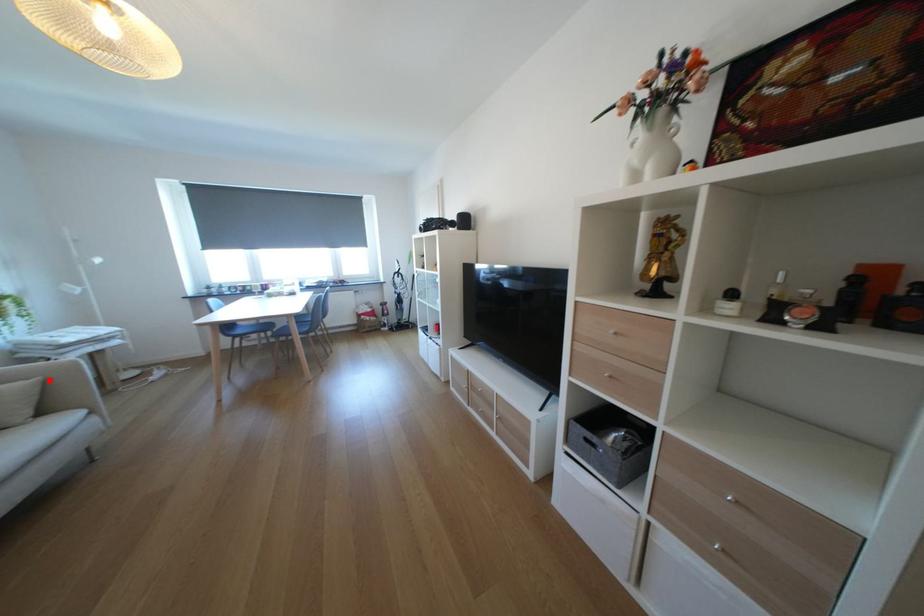
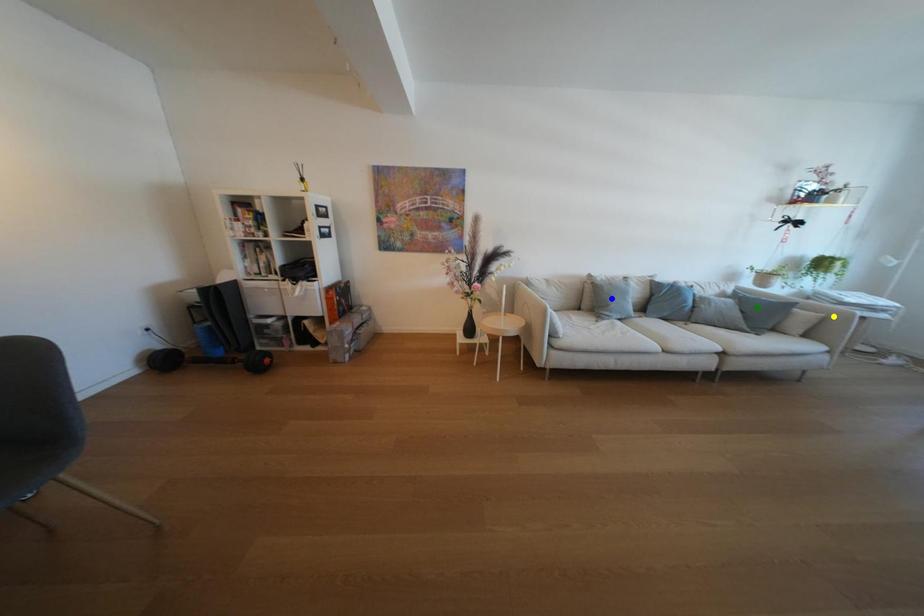
Question: I am providing you with two images of the same scene from different viewpoints. A red point is marked on the first image. You are given multiple points on the second image. Which point in image 2 is actually the same real-world point as the red point in image 1?

Choices:
 (A) green point
 (B) yellow point
 (C) blue point

Answer: (B)